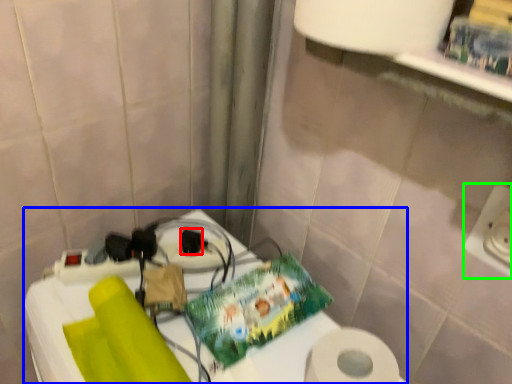
Question: Considering the real-world distances, which object is farthest from socket (highlighted by a red box)? table (highlighted by a blue box) or electric outlet (highlighted by a green box)?

Choices:
 (A) table
 (B) electric outlet

Answer: (B)